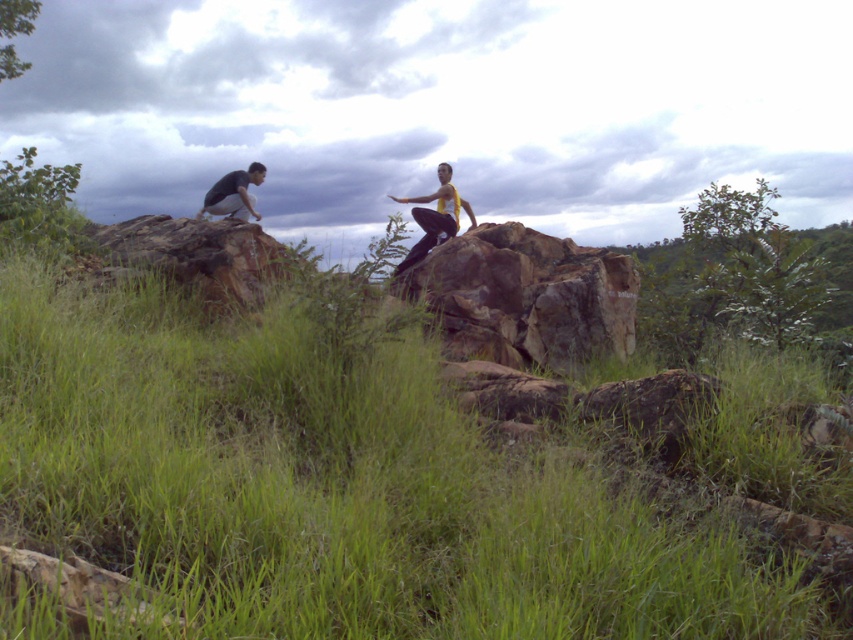
Can you confirm if rusty stone at center is bigger than yellow matte tank top at center?

Yes, rusty stone at center is bigger than yellow matte tank top at center.

Who is shorter, rusty stone at center or yellow matte tank top at center?

With less height is rusty stone at center.

The height and width of the screenshot is (640, 853). I want to click on rusty stone at center, so (x=527, y=296).

The height and width of the screenshot is (640, 853). Describe the element at coordinates (527, 296) in the screenshot. I see `rusty stone at center` at that location.

Is point (618, 262) closer to camera compared to point (256, 285)?

No, (618, 262) is further to viewer.

Does point (457, 323) come closer to viewer compared to point (198, 268)?

That is False.

The image size is (853, 640). I want to click on rusty stone at center, so click(x=527, y=296).

Which is above, green grassy at center or dark gray fabric shirt at left?

Positioned higher is dark gray fabric shirt at left.

Between green grassy at center and dark gray fabric shirt at left, which one has more height?

Standing taller between the two is green grassy at center.

Identify the location of green grassy at center. The height and width of the screenshot is (640, 853). (379, 477).

At what (x,y) coordinates should I click in order to perform the action: click on green grassy at center. Please return your answer as a coordinate pair (x, y). Looking at the image, I should click on tap(379, 477).